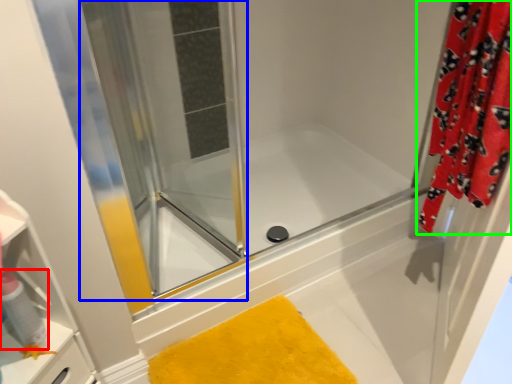
Question: Which object is positioned closest to cleaning product (highlighted by a red box)? Select from screen door (highlighted by a blue box) and curtain (highlighted by a green box).

Choices:
 (A) screen door
 (B) curtain

Answer: (A)